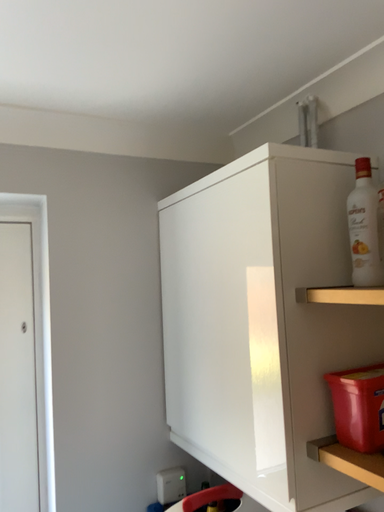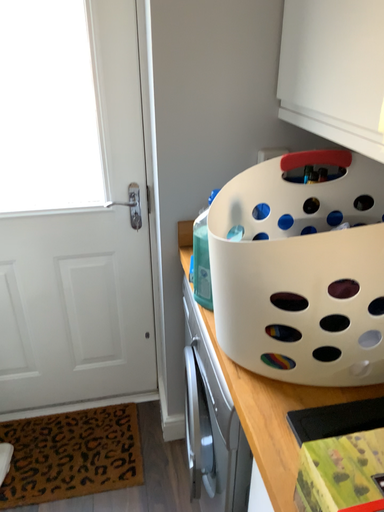
Question: How did the camera likely rotate when shooting the video?

Choices:
 (A) rotated left
 (B) rotated right

Answer: (A)